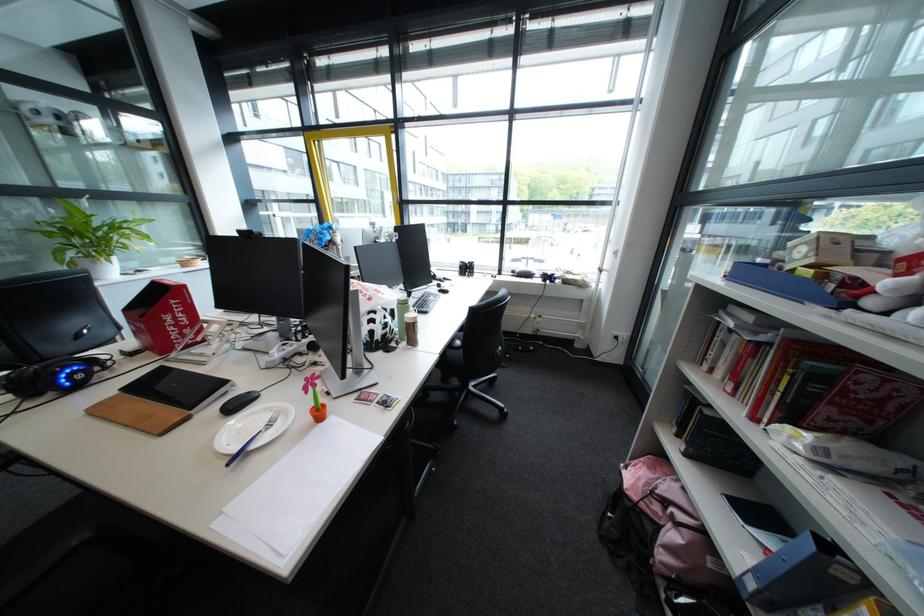
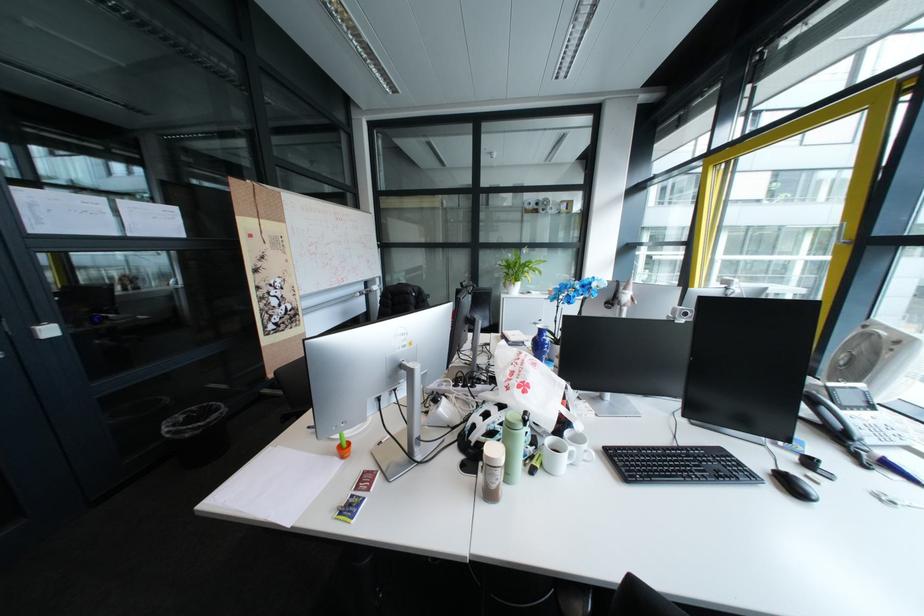
In the second image, find the point that corresponds to the point at 457,292 in the first image.

(805, 487)